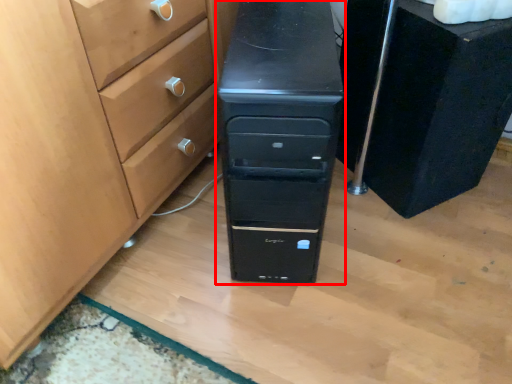
Question: From the image, what is the correct spatial relationship of chest of drawers (annotated by the red box) in relation to chest of drawers?

Choices:
 (A) right
 (B) left

Answer: (B)